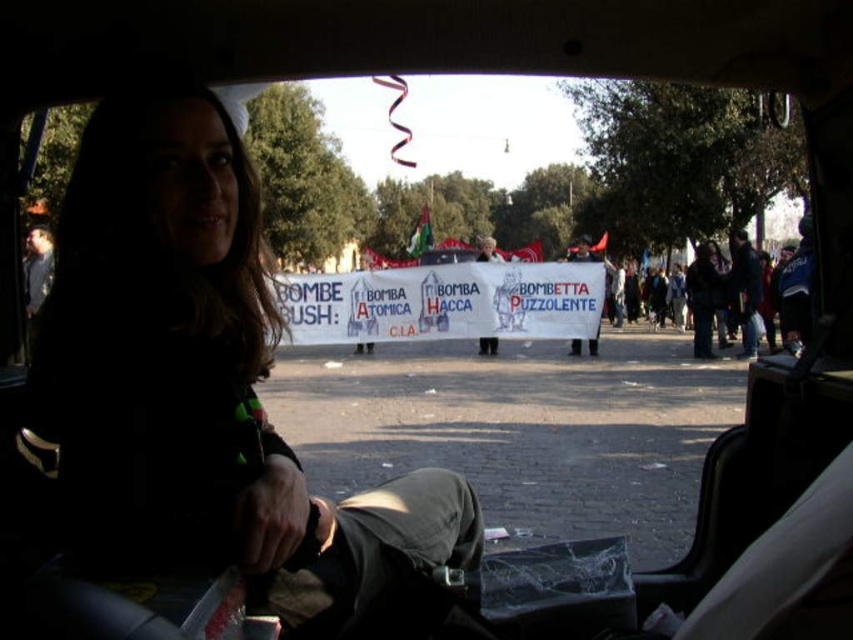
Question: Which point is closer to the camera?

Choices:
 (A) white paper banner at center
 (B) dark hair at center

Answer: (B)

Question: Is dark hair at center wider than white paper banner at center?

Choices:
 (A) yes
 (B) no

Answer: (B)

Question: Does dark hair at center have a greater width compared to white paper banner at center?

Choices:
 (A) no
 (B) yes

Answer: (A)

Question: Which of the following is the farthest from the observer?

Choices:
 (A) dark hair at center
 (B) white paper banner at center

Answer: (B)

Question: Is dark hair at center to the right of white paper banner at center from the viewer's perspective?

Choices:
 (A) yes
 (B) no

Answer: (B)

Question: Which object is farther from the camera taking this photo?

Choices:
 (A) dark hair at center
 (B) white paper banner at center

Answer: (B)